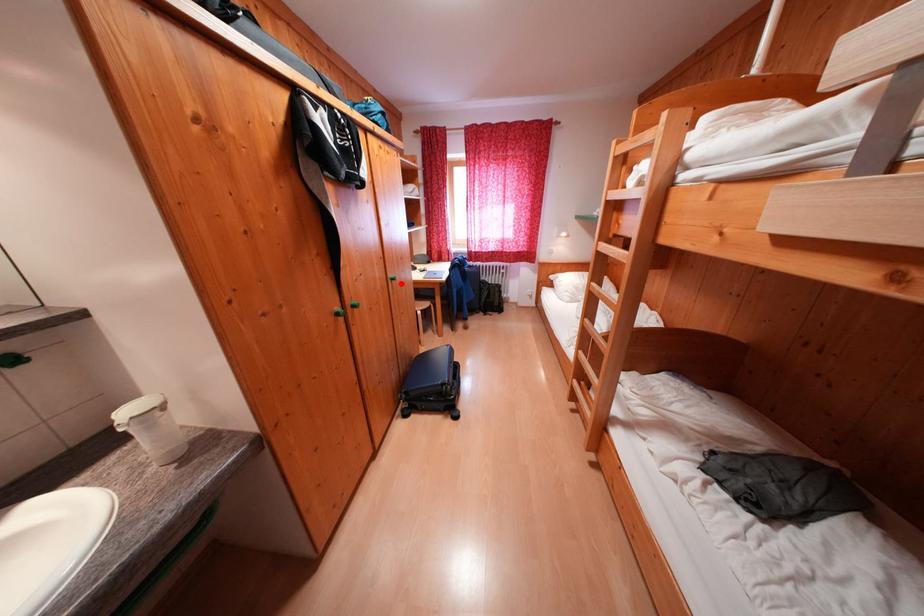
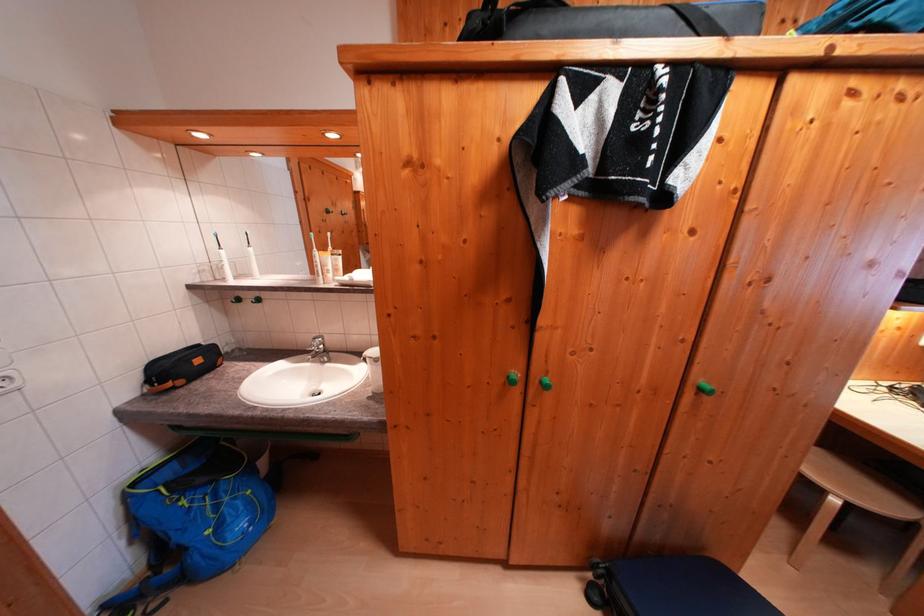
In the second image, find the point that corresponds to the highlighted location in the first image.

(709, 394)